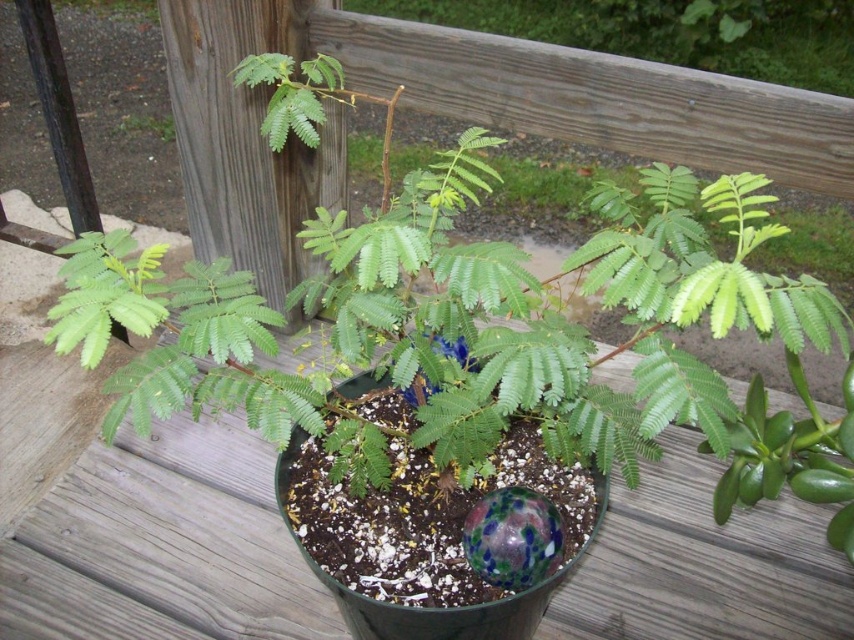
Can you confirm if green matte plant at upper center is thinner than green leafy plant at upper left?

No.

Is green matte plant at upper center further to the viewer compared to green leafy plant at upper left?

No, it is in front of green leafy plant at upper left.

Does point (623, 51) lie behind point (124, 125)?

That is True.

At what (x,y) coordinates should I click in order to perform the action: click on green matte plant at upper center. Please return your answer as a coordinate pair (x, y). Image resolution: width=854 pixels, height=640 pixels. Looking at the image, I should click on (670, 32).